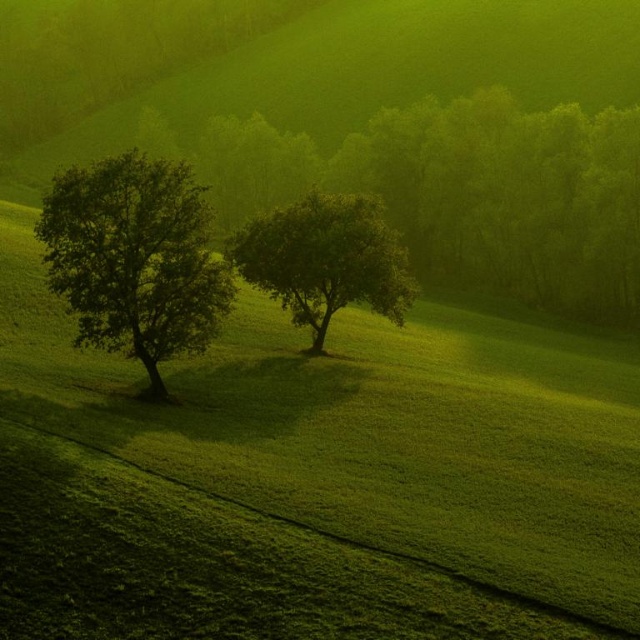
You are standing at the origin point in the image. Which direction should you walk to reach the green grassy field at center?

The green grassy field at center is located at point [314,477], so you should walk towards the right and slightly forward to reach it.

In the scene shown: You are a gardener planning to plant a new tree between the green leafy tree at left and the green leafy tree at center. The new tree requires a minimum of 10 meters of space between it and any existing trees. Is there enough space between the two existing trees to accommodate the new tree?

The green leafy tree at left is 10.33 meters from the green leafy tree at center. Since the new tree requires a minimum of 10 meters of space between it and existing trees, the distance between the two existing trees is sufficient to accommodate the new tree as long as it is placed exactly in the middle. However, the total distance between them is 10.33 meters, which allows for the required spacing when positioning the new tree appropriately.